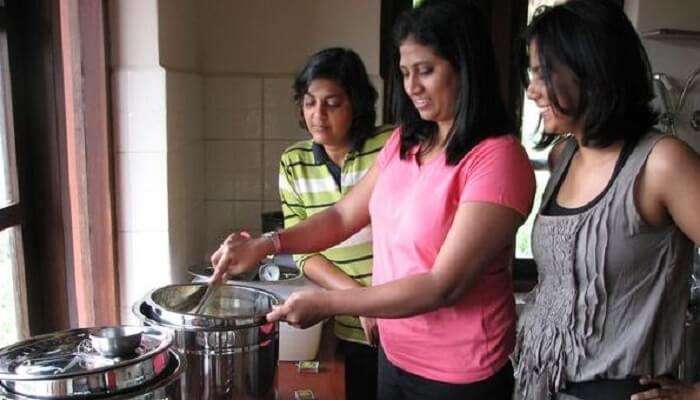
The height and width of the screenshot is (400, 700). In order to click on window in this screenshot , I will do `click(528, 132)`, `click(13, 238)`.